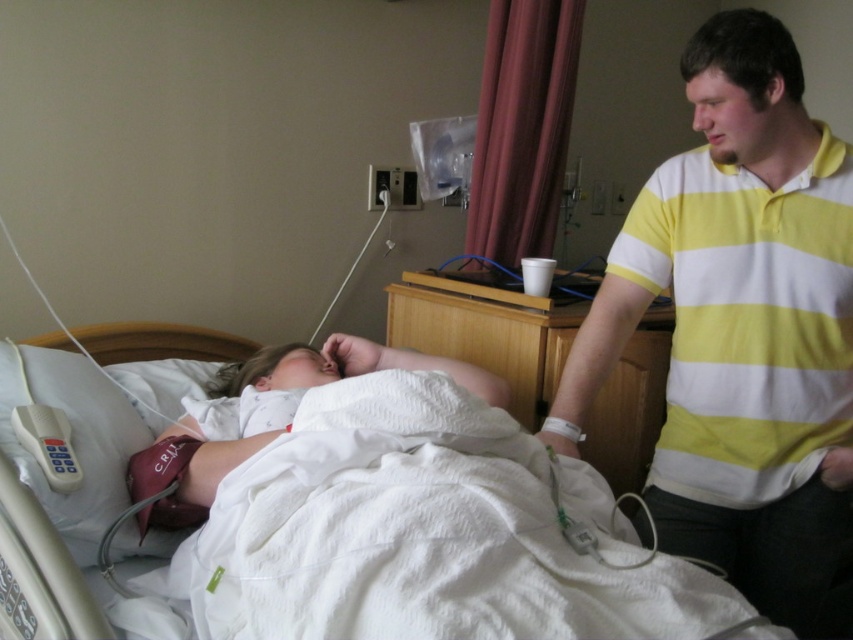
Does white soft baby at center appear over white plastic remote control at lower left?

Correct, white soft baby at center is located above white plastic remote control at lower left.

Looking at this image, who is positioned more to the right, white soft baby at center or white plastic remote control at lower left?

Positioned to the right is white soft baby at center.

Locate an element on the screen. The width and height of the screenshot is (853, 640). white soft baby at center is located at coordinates (408, 365).

Where is `white soft baby at center`? The width and height of the screenshot is (853, 640). white soft baby at center is located at coordinates (408, 365).

Who is more distant from viewer, (325, 540) or (25, 428)?

Positioned behind is point (25, 428).

Does white textured bed at center have a smaller size compared to white plastic remote control at lower left?

Actually, white textured bed at center might be larger than white plastic remote control at lower left.

Who is more distant from viewer, (70, 397) or (45, 474)?

The point (70, 397) is more distant.

This screenshot has width=853, height=640. In order to click on white textured bed at center in this screenshot , I will do `click(403, 538)`.

Between white textured bed at center and white fabric pillow at lower left, which one appears on the left side from the viewer's perspective?

Positioned to the left is white fabric pillow at lower left.

Can you confirm if white textured bed at center is positioned above white fabric pillow at lower left?

No, white textured bed at center is not above white fabric pillow at lower left.

Describe the element at coordinates (403, 538) in the screenshot. This screenshot has width=853, height=640. I see `white textured bed at center` at that location.

I want to click on white textured bed at center, so click(x=403, y=538).